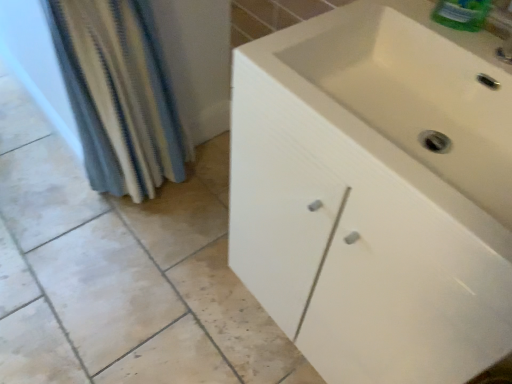
Image resolution: width=512 pixels, height=384 pixels. In order to click on free location to the right of blue striped fabric at left in this screenshot , I will do `click(199, 209)`.